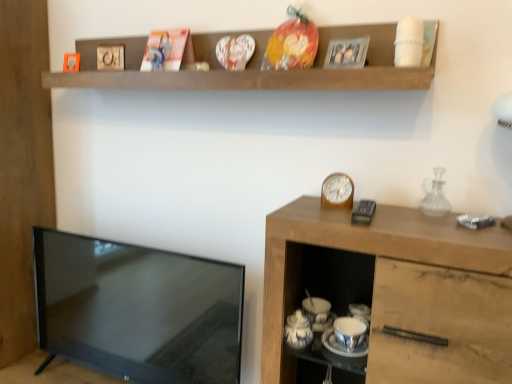
Question: Looking at their shapes, would you say metallic silver photo frame at upper center, which appears as the fourth picture frame when viewed from the left, is wider or thinner than metallic gold picture frame at upper center, which appears as the third picture frame when viewed from the front?

Choices:
 (A) thin
 (B) wide

Answer: (B)

Question: From the image's perspective, is metallic silver photo frame at upper center, which is counted as the 1th picture frame, starting from the front, located above or below metallic gold picture frame at upper center, which is the 2th picture frame in left-to-right order?

Choices:
 (A) above
 (B) below

Answer: (B)

Question: Considering the real-world distances, which object is closest to the metallic gold picture frame at upper center, placed as the 2th picture frame when sorted from back to front?

Choices:
 (A) matte wooden picture frame at upper left, positioned as the 4th picture frame in right-to-left order
 (B) brown wooden shelf at upper center
 (C) wooden clock at right
 (D) metallic silver photo frame at upper center, which appears as the fourth picture frame when viewed from the left
 (E) transparent glass carafe at right

Answer: (A)

Question: Which is nearer to the white glossy saucer at lower center?

Choices:
 (A) matte wooden picture frame at upper left, the first picture frame from the left
 (B) metallic silver photo frame at upper center, which is the first picture frame in right-to-left order
 (C) matte black tv at left
 (D) wooden cabinet at right
 (E) wooden clock at right

Answer: (D)